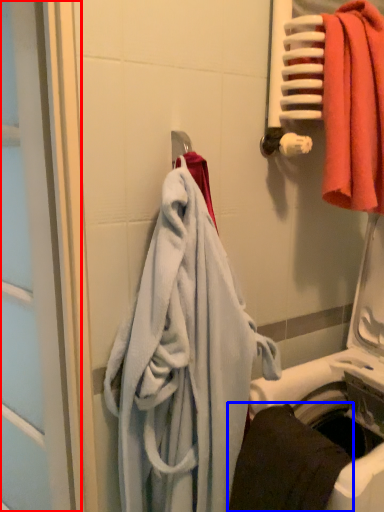
Question: Which of the following is the farthest to the observer, screen door (highlighted by a red box) or towel (highlighted by a blue box)?

Choices:
 (A) screen door
 (B) towel

Answer: (A)